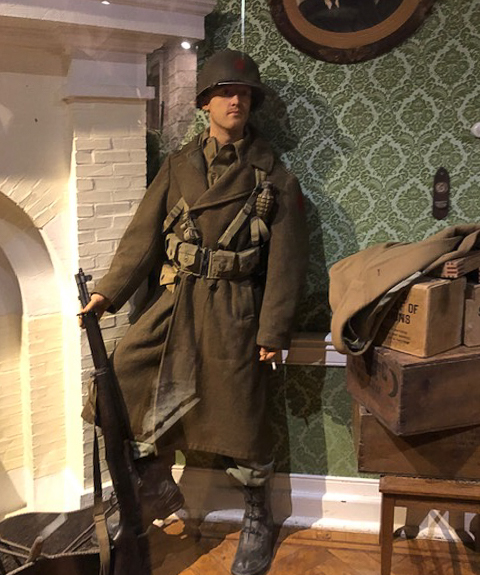
Where is `floor`? floor is located at coordinates (296, 555).